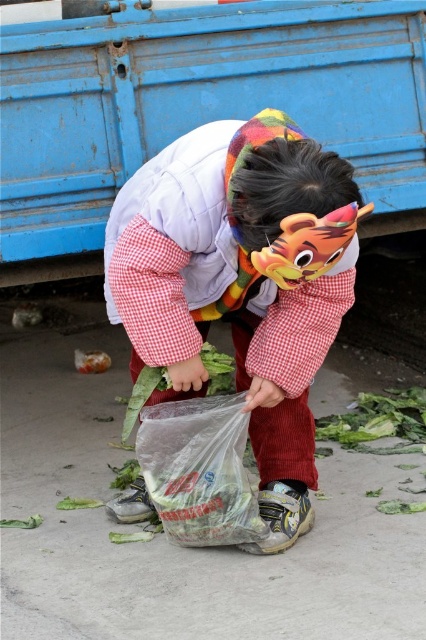
Is white corduroy pants at center below transparent plastic bag at center?

Actually, white corduroy pants at center is above transparent plastic bag at center.

The image size is (426, 640). What do you see at coordinates (235, 285) in the screenshot?
I see `white corduroy pants at center` at bounding box center [235, 285].

The height and width of the screenshot is (640, 426). In order to click on white corduroy pants at center in this screenshot , I will do `click(235, 285)`.